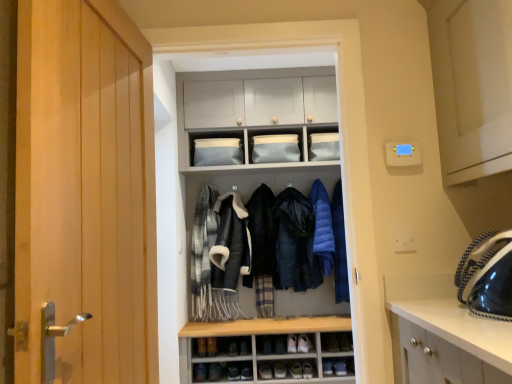
Image resolution: width=512 pixels, height=384 pixels. Identify the location of empty space that is ontop of matte blue fabric at upper center, the 1th cabinet in the left-to-right sequence (from a real-world perspective). (210, 134).